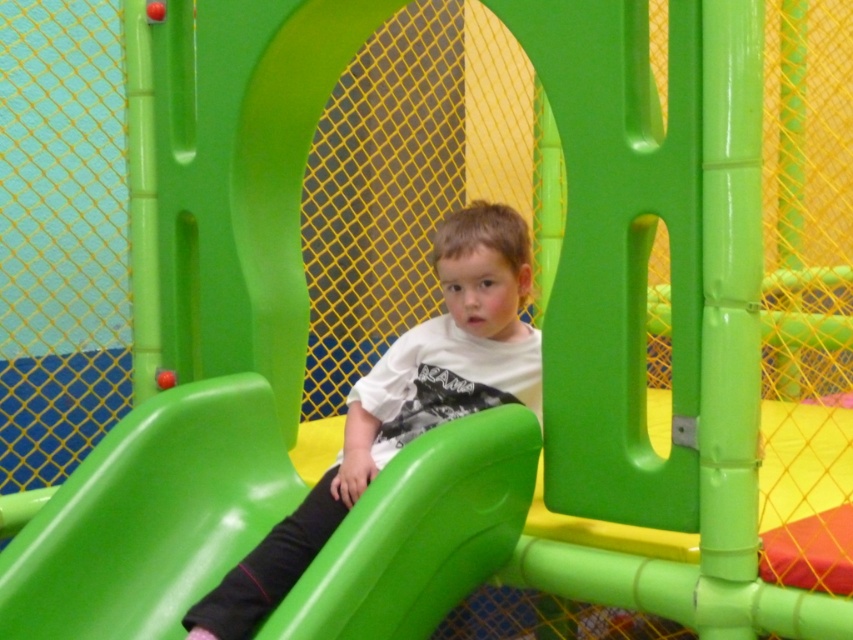
You are a parent standing at the entrance of an indoor play area and see your child on the green glossy slide at center. You want to walk over to the slide to talk to them. How many steps do you need to take if each step is about 2 feet long?

The green glossy slide at center is 6.96 feet away from the camera. Since each step is about 2 feet long, you would need to take approximately 3.48 steps. Since you can only take whole steps, you would need to take 4 steps to reach the slide.

You are a parent in an indoor play area. Your child is sitting on the green glossy slide at center while you are holding the matte white shirt at center. Can you reach out and hand the shirt to your child without moving from your current position?

The distance between the green glossy slide at center and the matte white shirt at center is 17.37 inches, so yes, you can reach out and hand the shirt to your child without moving from your current position.

You are a parent trying to locate your child in an indoor play area. You see the green glossy slide at center and the matte white shirt at center. Which object is closer to you?

The green glossy slide at center is closer to you because the matte white shirt at center is behind it.